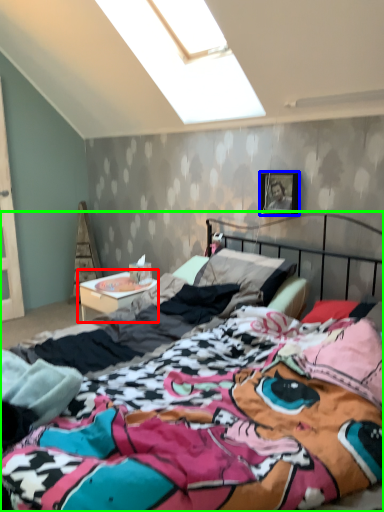
Question: Estimate the real-world distances between objects in this image. Which object is farther from nightstand (highlighted by a red box), picture frame (highlighted by a blue box) or bed (highlighted by a green box)?

Choices:
 (A) picture frame
 (B) bed

Answer: (B)